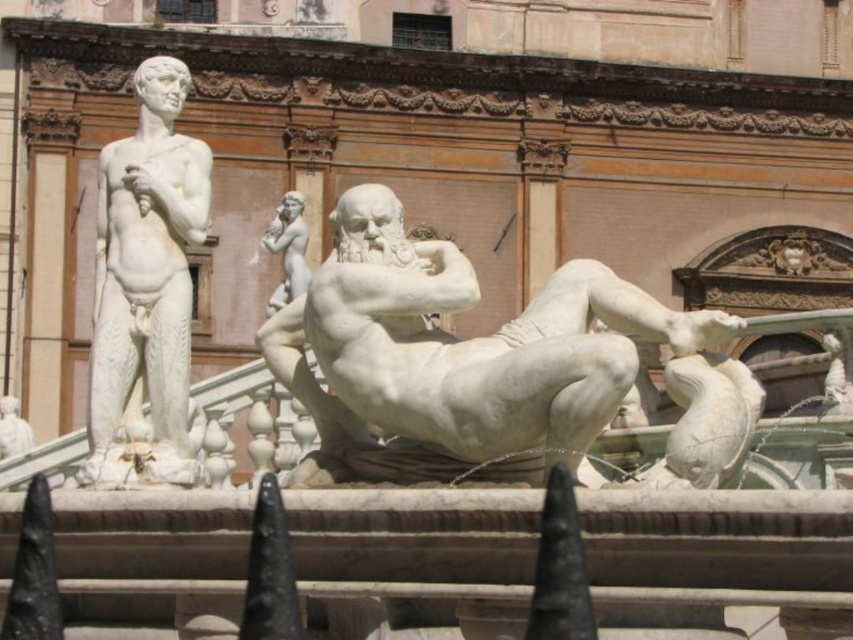
You are an art student observing the classical marble fountain. You notice the white marble statue at left and the white marble statue at center. Which one is positioned lower in the scene?

The white marble statue at left is positioned lower than the white marble statue at center because it is below it.

You are an art student standing at the base of the fountain. You need to sketch both the white marble reclining figure at center and the white marble statue at center. Which one should you sketch first if you want to start with the one closer to you?

The white marble reclining figure at center is 54.71 feet away from the white marble statue at center. Since you want to start with the closer one, you should sketch the white marble reclining figure at center first because it is positioned closer to you compared to the white marble statue at center.

You are an art student analyzing the fountain. You notice the white marble statue at left and the white marble statue at center. Which statue is taller?

The white marble statue at center is taller than the white marble statue at left.